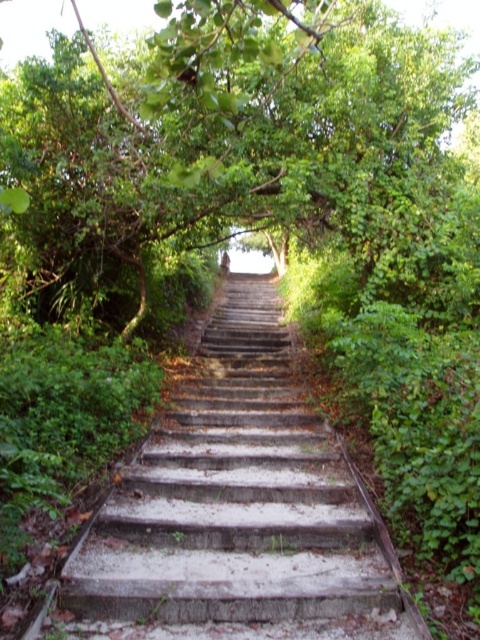
You are hiking up a trail and see the concrete stairs at center and the green leafy tree at center. Which object is positioned higher in the scene?

The green leafy tree at center is positioned higher than the concrete stairs at center because the concrete stairs at center is located below it.

You are standing at the bottom of the concrete stairs at center and want to walk towards the green leafy tree at center. Which direction should you move relative to the stairs?

You should move to the right relative to the concrete stairs at center because the green leafy tree at center is located to the right of the stairs.

You are a hiker trying to take a photo of the concrete stairs at center and the green leafy tree at center from a distance. Which object will appear larger in the photo?

The concrete stairs at center will appear larger in the photo because it is bigger than the green leafy tree at center.